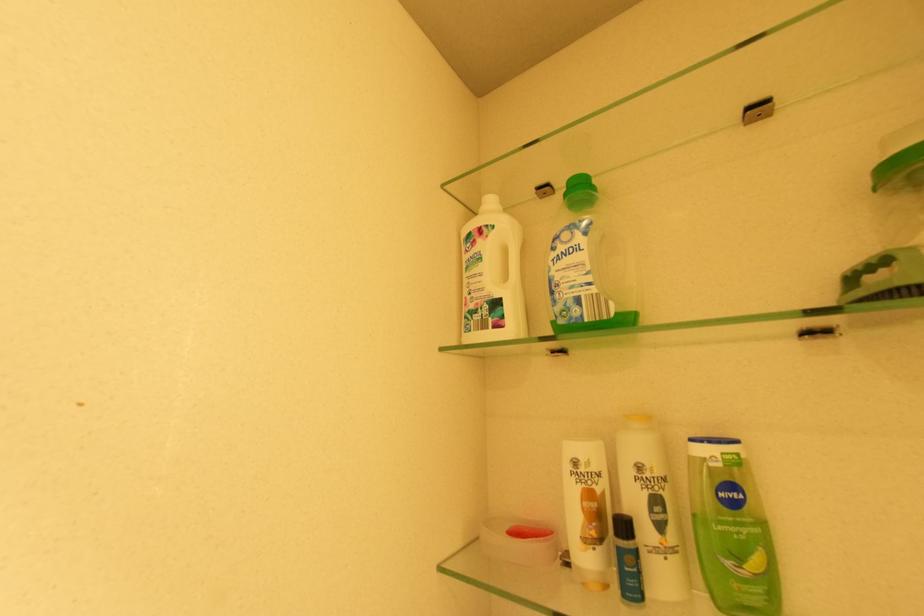
Image resolution: width=924 pixels, height=616 pixels. What do you see at coordinates (578, 184) in the screenshot?
I see `the green bottle cap` at bounding box center [578, 184].